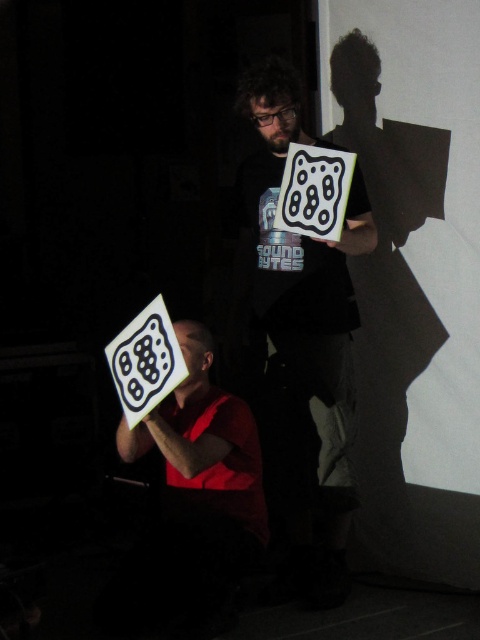
Is white glossy square at lower left thinner than matte black face at center?

Incorrect, white glossy square at lower left's width is not less than matte black face at center's.

Is white glossy square at lower left to the right of matte black face at center from the viewer's perspective?

No, white glossy square at lower left is not to the right of matte black face at center.

Who is more forward, (175, 337) or (197, 337)?

Point (175, 337) is more forward.

The height and width of the screenshot is (640, 480). What are the coordinates of `white glossy square at lower left` in the screenshot? It's located at (144, 362).

Which of these two, white matte square at upper center or matte black face at center, stands shorter?

With less height is matte black face at center.

Is point (300, 156) in front of point (181, 392)?

Yes, it is.

Locate an element on the screen. white matte square at upper center is located at coordinates (314, 192).

Find the location of `white glossy square at lower left`. white glossy square at lower left is located at coordinates (144, 362).

Does white glossy square at lower left appear on the left side of matte black face at upper center?

Indeed, white glossy square at lower left is positioned on the left side of matte black face at upper center.

What do you see at coordinates (144, 362) in the screenshot?
I see `white glossy square at lower left` at bounding box center [144, 362].

At what (x,y) coordinates should I click in order to perform the action: click on white glossy square at lower left. Please return your answer as a coordinate pair (x, y). This screenshot has height=640, width=480. Looking at the image, I should click on (144, 362).